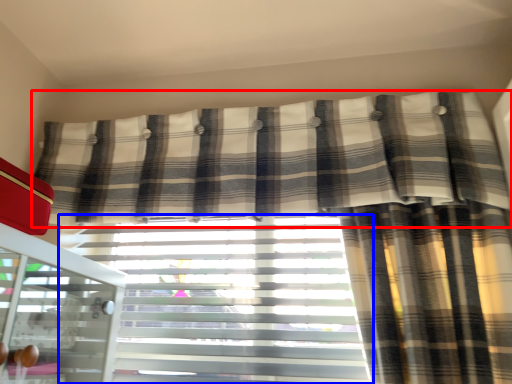
Question: Which object appears closest to the camera in this image, curtain (highlighted by a red box) or window blind (highlighted by a blue box)?

Choices:
 (A) curtain
 (B) window blind

Answer: (A)